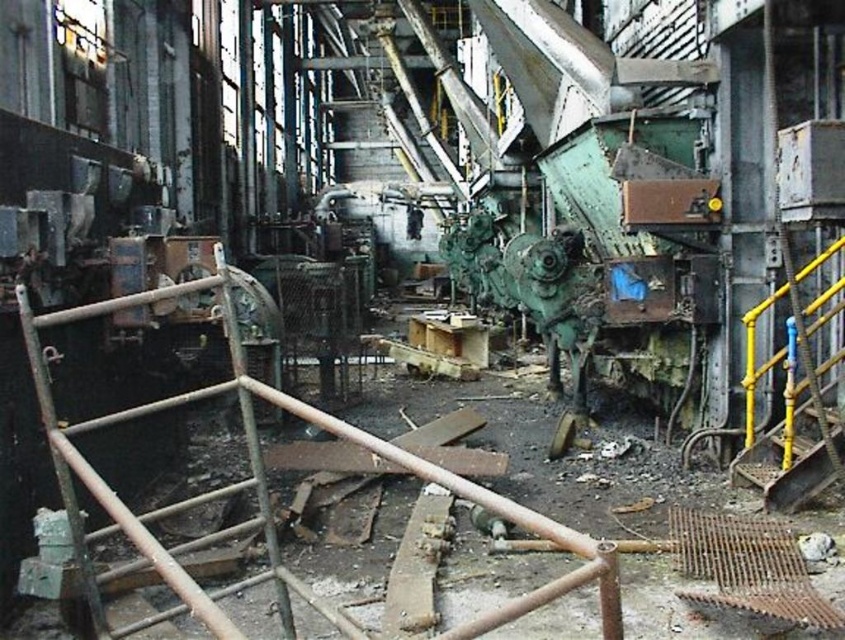
Question: Which object is farther from the camera taking this photo?

Choices:
 (A) rusty metal ladder at left
 (B) yellow metal ladder at right

Answer: (B)

Question: Among these points, which one is nearest to the camera?

Choices:
 (A) (799, 406)
 (B) (189, 284)

Answer: (B)

Question: In this image, where is rusty metal ladder at left located relative to yellow metal ladder at right?

Choices:
 (A) below
 (B) above

Answer: (A)

Question: Does rusty metal ladder at left appear on the left side of yellow metal ladder at right?

Choices:
 (A) no
 (B) yes

Answer: (B)

Question: Observing the image, what is the correct spatial positioning of rusty metal ladder at left in reference to yellow metal ladder at right?

Choices:
 (A) below
 (B) above

Answer: (A)